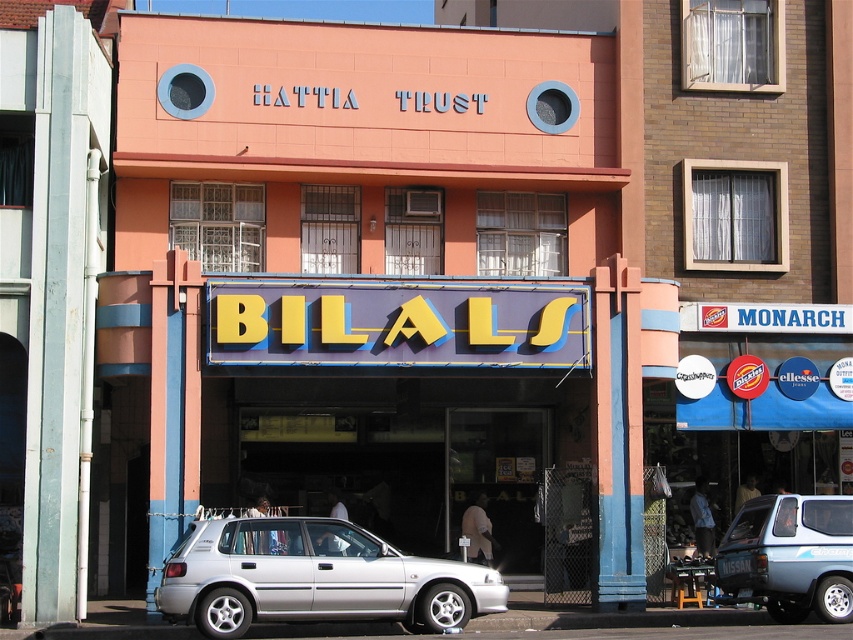
Question: Which object is closer to the camera taking this photo?

Choices:
 (A) silver metallic hatchback at lower center
 (B) blue metallic hatchback at lower right

Answer: (A)

Question: Can you confirm if silver metallic hatchback at lower center is bigger than blue metallic hatchback at lower right?

Choices:
 (A) yes
 (B) no

Answer: (A)

Question: Does silver metallic hatchback at lower center appear under blue metallic hatchback at lower right?

Choices:
 (A) yes
 (B) no

Answer: (A)

Question: Does silver metallic hatchback at lower center have a greater width compared to blue metallic hatchback at lower right?

Choices:
 (A) no
 (B) yes

Answer: (B)

Question: Which object is closer to the camera taking this photo?

Choices:
 (A) silver metallic hatchback at lower center
 (B) blue metallic hatchback at lower right

Answer: (A)